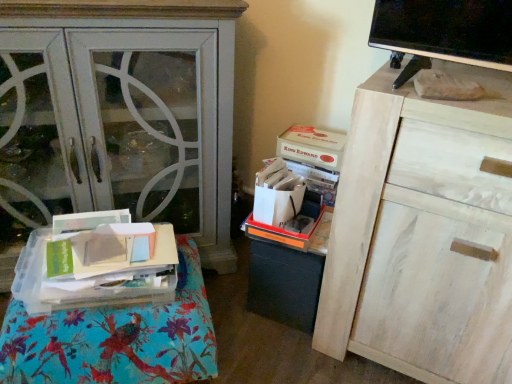
Question: Is matte white cabinet at left oriented away from white cardboard box at upper center, the first storage box when ordered from top to bottom?

Choices:
 (A) no
 (B) yes

Answer: (A)

Question: Does matte white cabinet at left appear on the right side of white cardboard box at upper center, placed as the second storage box when sorted from bottom to top?

Choices:
 (A) yes
 (B) no

Answer: (B)

Question: Is matte white cabinet at left next to white cardboard box at upper center, the first storage box when ordered from top to bottom, and touching it?

Choices:
 (A) no
 (B) yes

Answer: (A)

Question: Is matte white cabinet at left bigger than white cardboard box at upper center, placed as the second storage box when sorted from bottom to top?

Choices:
 (A) yes
 (B) no

Answer: (A)

Question: Considering the relative sizes of matte white cabinet at left and white cardboard box at upper center, placed as the second storage box when sorted from bottom to top, in the image provided, is matte white cabinet at left smaller than white cardboard box at upper center, placed as the second storage box when sorted from bottom to top,?

Choices:
 (A) yes
 (B) no

Answer: (B)

Question: Can you confirm if matte white cabinet at left is wider than white cardboard box at upper center, the first storage box when ordered from top to bottom?

Choices:
 (A) no
 (B) yes

Answer: (B)

Question: Is orange plastic storage box at center, which is the 1th storage box from bottom to top, surrounding white cardboard box at upper center, placed as the second storage box when sorted from bottom to top?

Choices:
 (A) no
 (B) yes

Answer: (A)

Question: Can you confirm if orange plastic storage box at center, which is counted as the 2th storage box, starting from the top, is smaller than white cardboard box at upper center, placed as the second storage box when sorted from bottom to top?

Choices:
 (A) no
 (B) yes

Answer: (A)

Question: Is there a large distance between orange plastic storage box at center, which is the 1th storage box from bottom to top, and white cardboard box at upper center, placed as the second storage box when sorted from bottom to top?

Choices:
 (A) yes
 (B) no

Answer: (B)

Question: Can you confirm if orange plastic storage box at center, which is the 1th storage box from bottom to top, is taller than white cardboard box at upper center, the first storage box when ordered from top to bottom?

Choices:
 (A) yes
 (B) no

Answer: (A)

Question: Does orange plastic storage box at center, which is the 1th storage box from bottom to top, turn towards white cardboard box at upper center, placed as the second storage box when sorted from bottom to top?

Choices:
 (A) yes
 (B) no

Answer: (B)

Question: Does orange plastic storage box at center, which is counted as the 2th storage box, starting from the top, lie in front of white cardboard box at upper center, the first storage box when ordered from top to bottom?

Choices:
 (A) no
 (B) yes

Answer: (B)

Question: Is matte white cabinet at left to the right of orange plastic storage box at center, which is the 1th storage box from bottom to top, from the viewer's perspective?

Choices:
 (A) yes
 (B) no

Answer: (B)